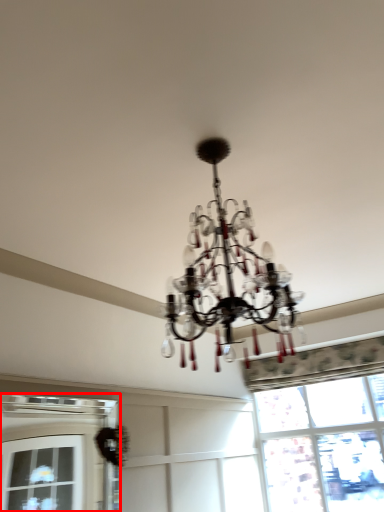
Question: Considering the relative positions of window (annotated by the red box) and window in the image provided, where is window (annotated by the red box) located with respect to the staircase?

Choices:
 (A) left
 (B) right

Answer: (A)